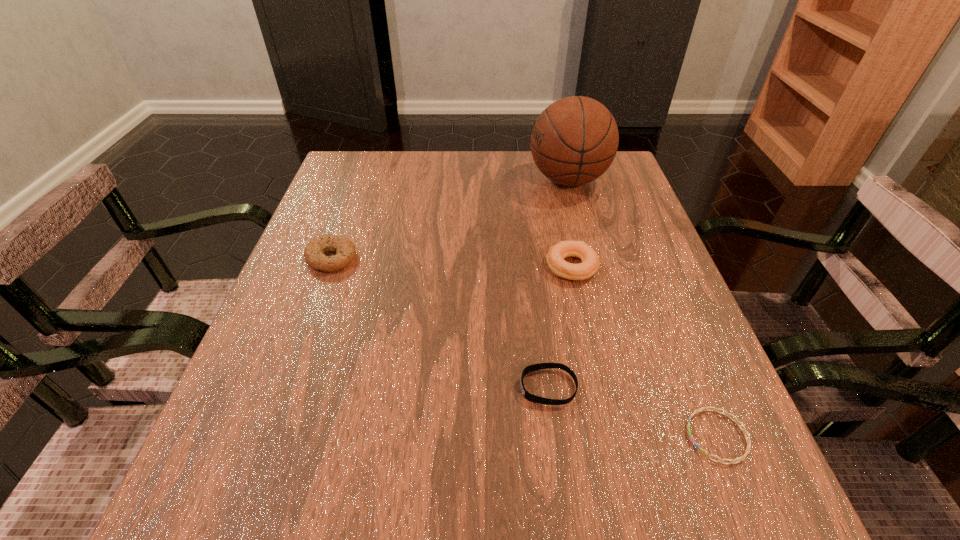
The width and height of the screenshot is (960, 540). Find the location of `free space between the farthest object and the right bagel`. free space between the farthest object and the right bagel is located at coordinates click(x=570, y=223).

You are a GUI agent. You are given a task and a screenshot of the screen. Output one action in this format:
    pyautogui.click(x=<x>, y=<y>)
    Task: Click on the empty space between the leftmost object and the bracelet
    This screenshot has width=960, height=540.
    Given the screenshot: What is the action you would take?
    pyautogui.click(x=524, y=347)

Locate an element on the screen. The image size is (960, 540). blank region between the nearest object and the basketball is located at coordinates (642, 308).

Choose which object is the fourth nearest neighbor to the right bagel. Please provide its 2D coordinates. Your answer should be formatted as a tuple, i.e. [(x, y)], where the tuple contains the x and y coordinates of a point satisfying the conditions above.

[(344, 248)]

Locate which object ranks third in proximity to the fourth farthest object. Please provide its 2D coordinates. Your answer should be formatted as a tuple, i.e. [(x, y)], where the tuple contains the x and y coordinates of a point satisfying the conditions above.

[(344, 248)]

Find the location of a particular element. free spot that satisfies the following two spatial constraints: 1. on the side with brand label of the tallest object; 2. on the front side of the leftmost object is located at coordinates (589, 258).